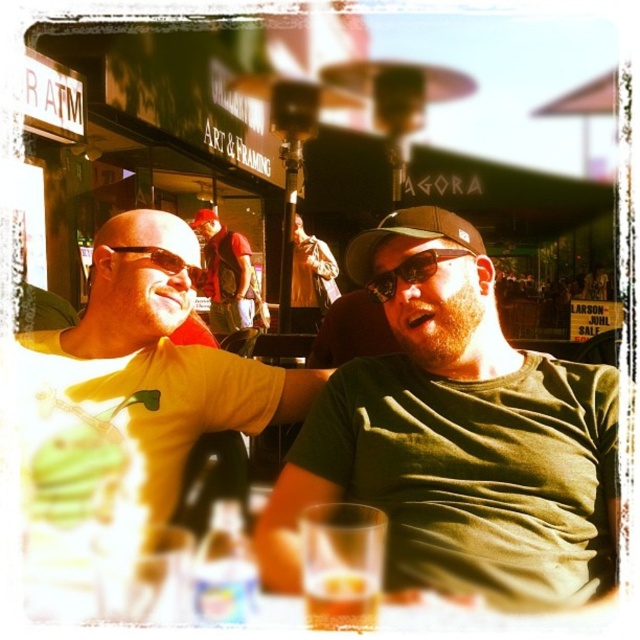
You are a photographer trying to capture a candid shot of the two people at the table. You notice the green matte shirt at center and the sunglasses at center. Which object should you focus on first if you want to ensure both are in focus without adjusting your camera settings?

The green matte shirt at center is located below sunglasses at center, so focusing on the sunglasses at center first will ensure both are in focus since they are closer to the camera.

You are a waiter at this outdoor cafe and need to place a new drink order on the table. The drink is in a cup slightly larger than the sunglasses at center. Can the translucent glass at lower center fit the drink?

The translucent glass at lower center has a smaller size compared to sunglasses at center. Since the drink cup is larger than the sunglasses at center, it would be too big for the translucent glass at lower center to accommodate. Please choose a larger glass or another surface.